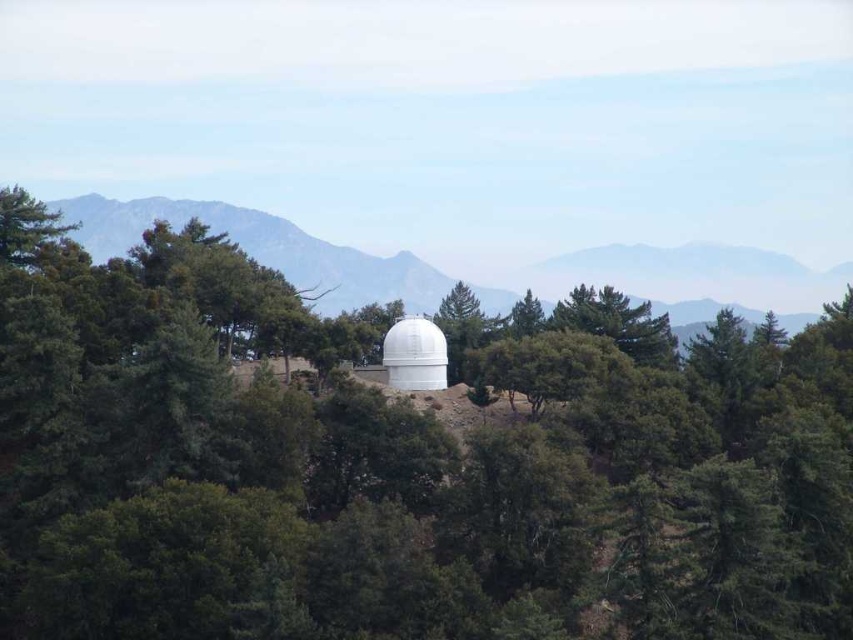
Which is more to the right, green matte forest at center or white smooth dome at center?

Positioned to the right is white smooth dome at center.

Between green matte forest at center and white smooth dome at center, which one has more height?

white smooth dome at center

The width and height of the screenshot is (853, 640). I want to click on green matte forest at center, so click(x=399, y=465).